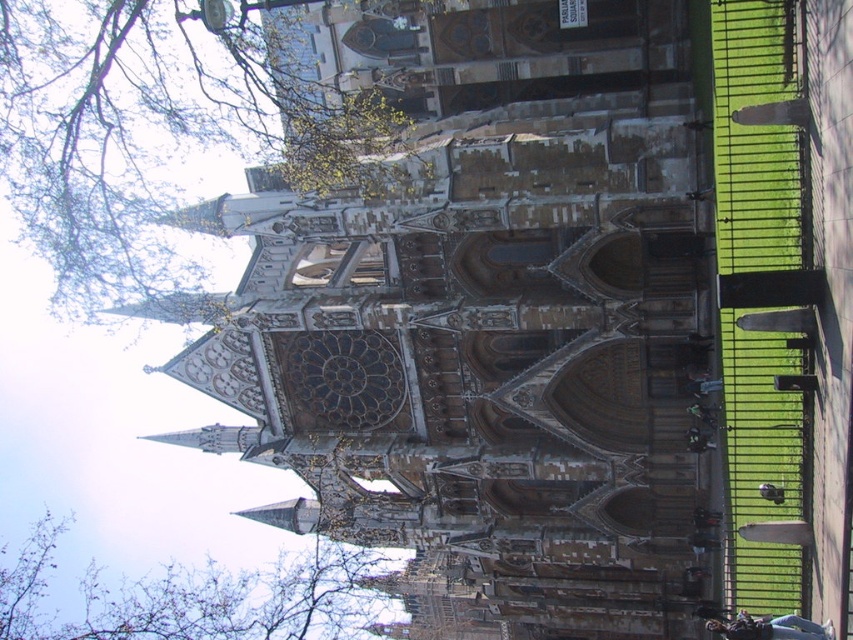
Question: Which object is farther from the camera taking this photo?

Choices:
 (A) green leafy tree at upper left
 (B) bare branches at upper left

Answer: (B)

Question: Is green leafy tree at upper left below bare branches at upper left?

Choices:
 (A) no
 (B) yes

Answer: (A)

Question: Which of the following is the farthest from the observer?

Choices:
 (A) bare branches at upper left
 (B) brown stone tower at center

Answer: (A)

Question: Is green leafy tree at upper left to the left of bare branches at upper left from the viewer's perspective?

Choices:
 (A) no
 (B) yes

Answer: (A)

Question: Is brown stone tower at center thinner than bare branches at upper left?

Choices:
 (A) no
 (B) yes

Answer: (A)

Question: Which is nearer to the green leafy tree at upper left?

Choices:
 (A) bare branches at upper left
 (B) brown stone tower at center

Answer: (B)